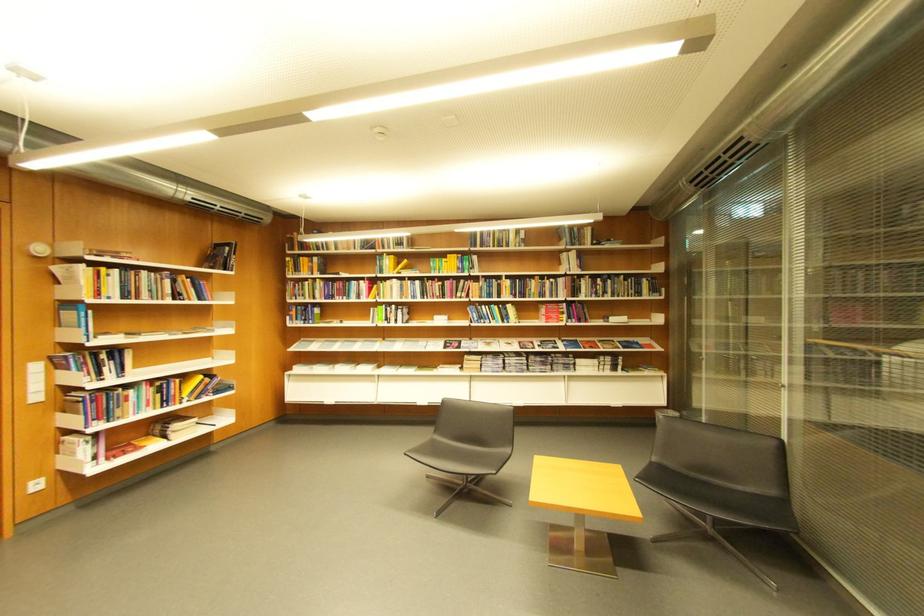
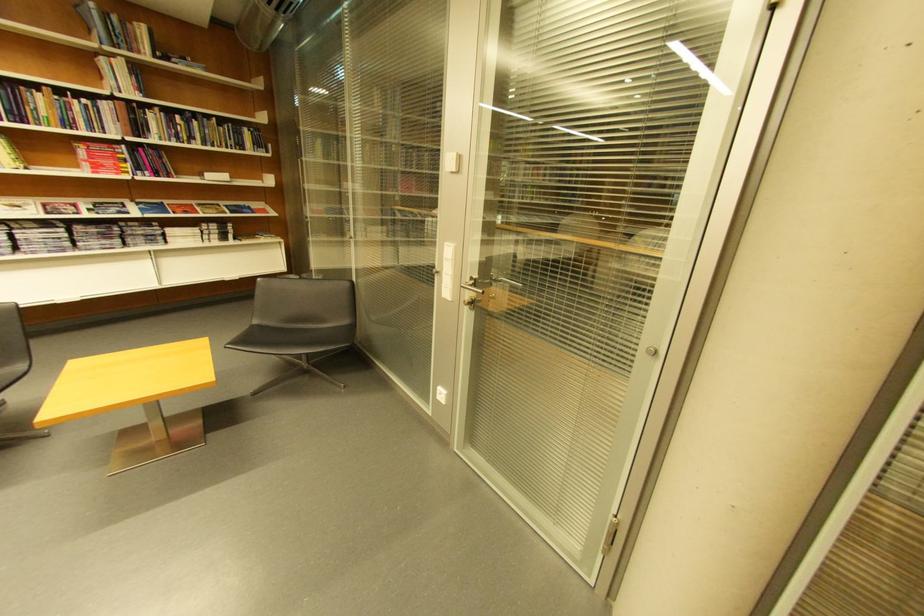
Where in the second image is the point corresponding to pixel 542 293 from the first image?

(54, 116)